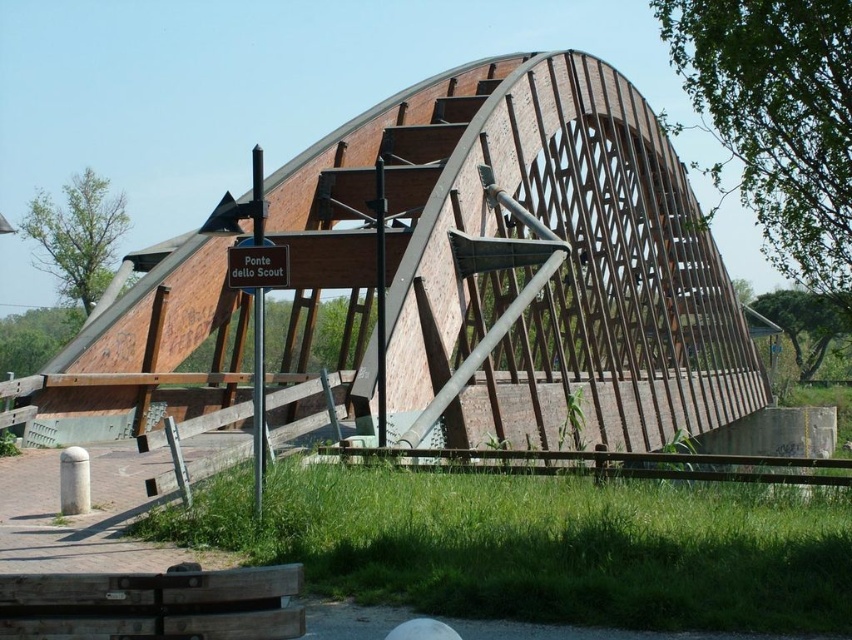
Does brick/concrete bridge at center have a greater width compared to brown wooden sign at center?

Yes.

Between brick/concrete bridge at center and brown wooden sign at center, which one is positioned higher?

brown wooden sign at center

Between point (458, 300) and point (246, 259), which one is positioned in front?

Point (246, 259) is more forward.

Where is `brick/concrete bridge at center`? This screenshot has width=852, height=640. brick/concrete bridge at center is located at coordinates (517, 264).